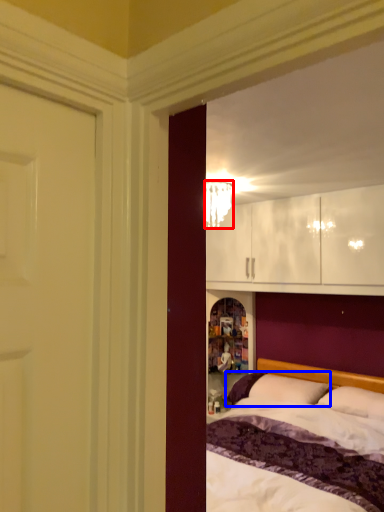
Question: Which point is closer to the camera, lamp (highlighted by a red box) or pillow (highlighted by a blue box)?

Choices:
 (A) lamp
 (B) pillow

Answer: (A)